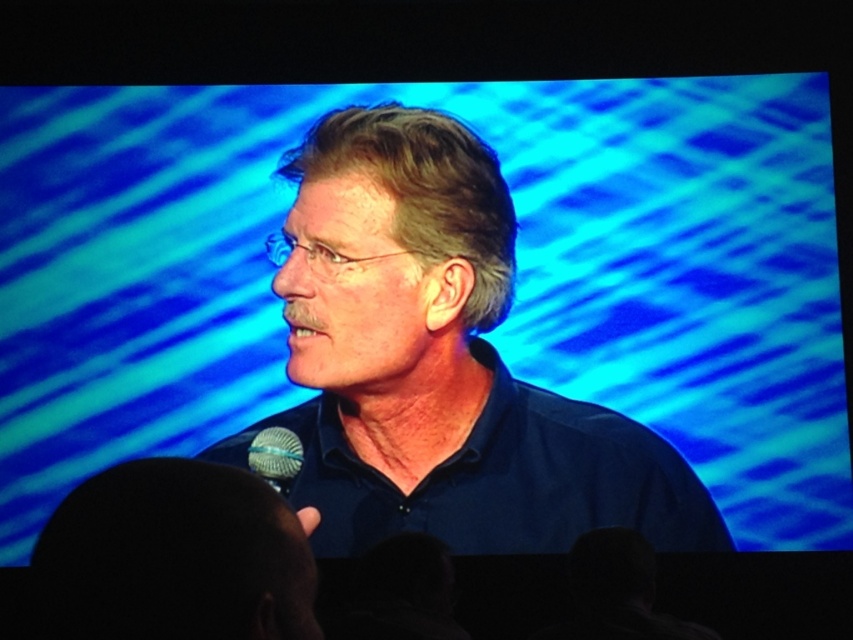
Question: Does blue matte shirt at center lie behind satin silver microphone at lower center?

Choices:
 (A) yes
 (B) no

Answer: (A)

Question: Is the position of blue matte shirt at center less distant than that of satin silver microphone at lower center?

Choices:
 (A) yes
 (B) no

Answer: (B)

Question: Which of the following is the closest to the observer?

Choices:
 (A) (281, 428)
 (B) (570, 444)

Answer: (A)

Question: Is blue matte shirt at center to the left of satin silver microphone at lower center from the viewer's perspective?

Choices:
 (A) no
 (B) yes

Answer: (A)

Question: Which of the following is the closest to the observer?

Choices:
 (A) satin silver microphone at lower center
 (B) blue matte shirt at center

Answer: (A)